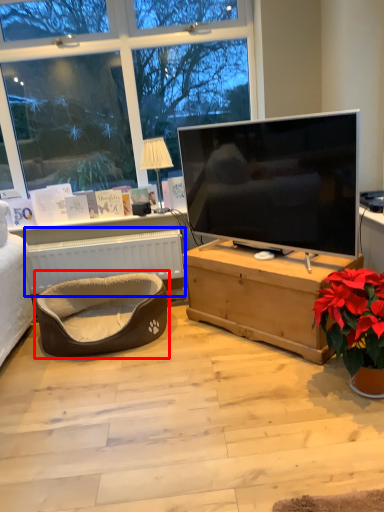
Question: Which object appears farthest to the camera in this image, bean bag chair (highlighted by a red box) or radiator (highlighted by a blue box)?

Choices:
 (A) bean bag chair
 (B) radiator

Answer: (B)